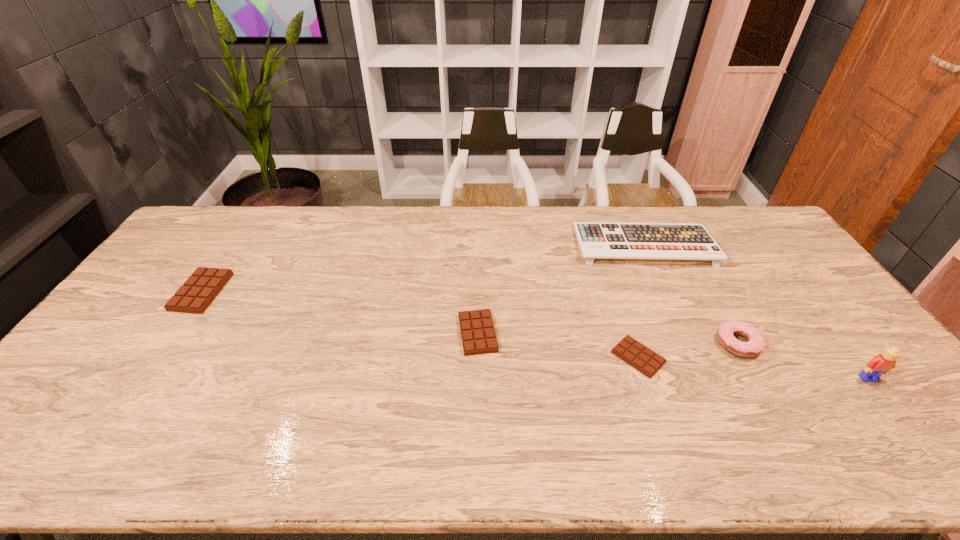
What are the coordinates of `vacant space located 0.050m on the front of the tallest candy bar` in the screenshot? It's located at (178, 327).

The image size is (960, 540). Identify the location of vacant space located 0.240m on the left of the fifth tallest object. (372, 333).

I want to click on free region located 0.240m on the right of the shortest object, so [x=754, y=357].

Where is `free space located 0.200m on the left of the doughnut`? The image size is (960, 540). free space located 0.200m on the left of the doughnut is located at coordinates (644, 344).

In order to click on vacant area situated on the front of the farthest object in this screenshot , I will do `click(687, 342)`.

Locate an element on the screen. free space located 0.070m on the front-facing side of the tallest object is located at coordinates (891, 407).

The width and height of the screenshot is (960, 540). Find the location of `object present at the far edge`. object present at the far edge is located at coordinates (597, 240).

Where is `object located in the left edge section of the desktop`? Image resolution: width=960 pixels, height=540 pixels. object located in the left edge section of the desktop is located at coordinates (200, 289).

You are a GUI agent. You are given a task and a screenshot of the screen. Output one action in this format:
    pyautogui.click(x=<x>, y=<y>)
    Task: Click on the object located at the right edge
    The image size is (960, 540).
    Given the screenshot: What is the action you would take?
    pyautogui.click(x=886, y=362)

Identify the location of vacant space at the far edge of the desktop. (248, 239).